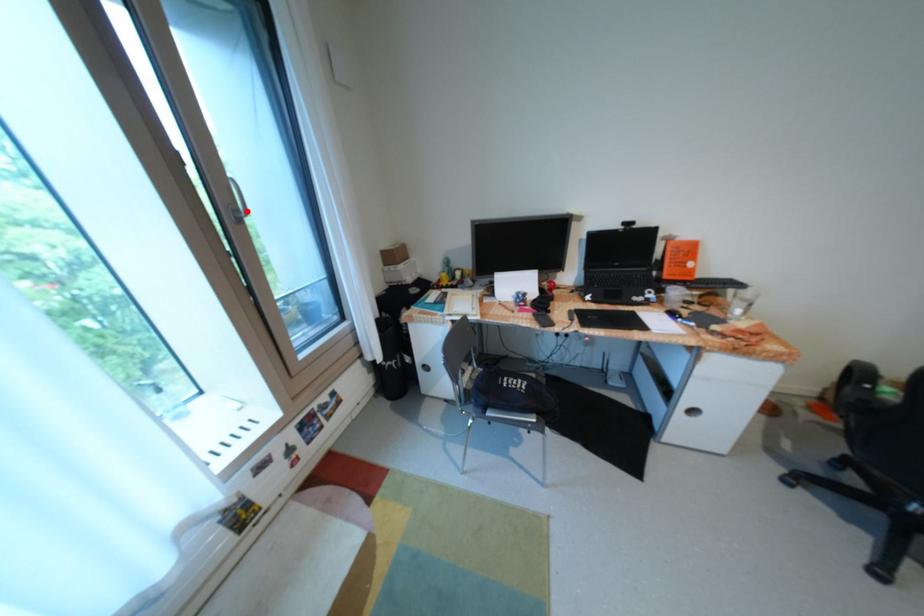
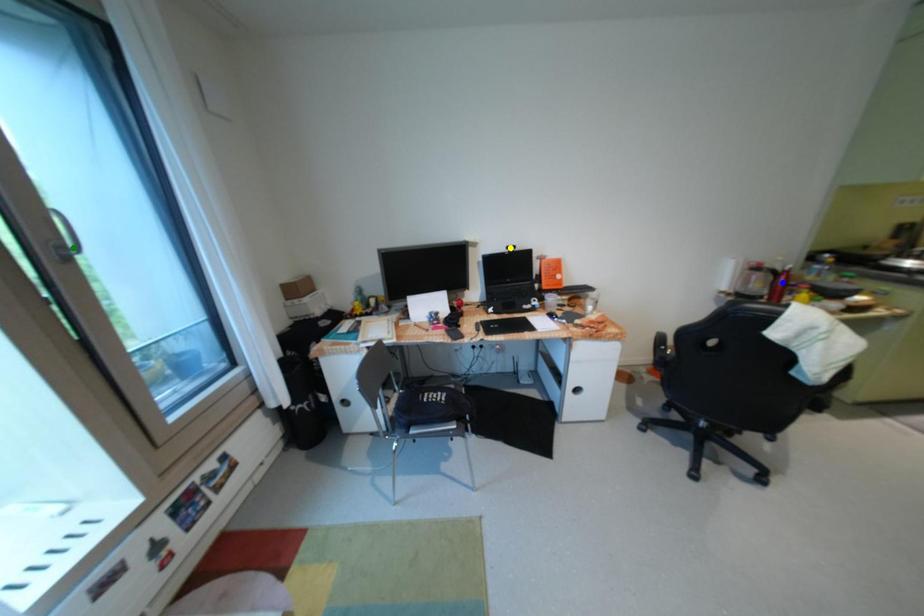
Question: I am providing you with two images of the same scene from different viewpoints. A red point is marked on the first image. You are given multiple points on the second image. In image 2, which mark is for the same physical point as the one in image 1?

Choices:
 (A) green point
 (B) yellow point
 (C) blue point

Answer: (A)